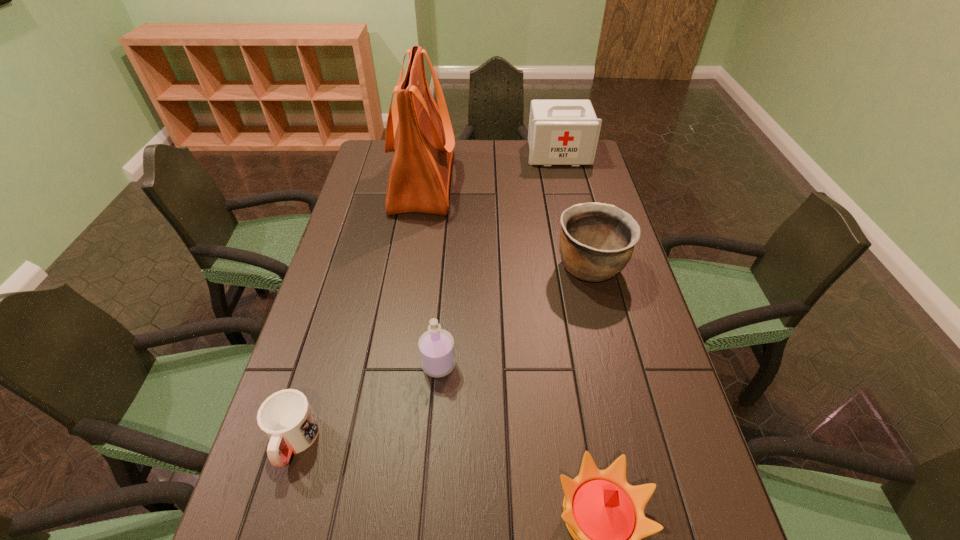
Image resolution: width=960 pixels, height=540 pixels. Identify the location of free point at the left edge. (276, 526).

You are a GUI agent. You are given a task and a screenshot of the screen. Output one action in this format:
    pyautogui.click(x=<x>, y=<y>)
    Task: Click on the vacant space at the right edge of the desktop
    The height and width of the screenshot is (540, 960).
    Given the screenshot: What is the action you would take?
    pyautogui.click(x=658, y=533)

I want to click on vacant space in between the perfume and the pottery, so click(515, 316).

The image size is (960, 540). What are the coordinates of `vacant point located between the third farthest object and the perfume` in the screenshot? It's located at 515,316.

This screenshot has height=540, width=960. I want to click on unoccupied position between the second tallest object and the shopping bag, so click(491, 168).

Identify the location of free space that is in between the first-aid kit and the tallest object. (491, 168).

The height and width of the screenshot is (540, 960). Identify the location of unoccupied position between the shortest object and the perfume. (366, 403).

Find the location of a particular element. This screenshot has width=960, height=540. vacant space in between the tallest object and the shortest object is located at coordinates (358, 312).

Locate an element on the screen. The width and height of the screenshot is (960, 540). free point between the first-aid kit and the shortest object is located at coordinates (426, 298).

Identify which object is the fifth closest to the shopping bag. Please provide its 2D coordinates. Your answer should be formatted as a tuple, i.e. [(x, y)], where the tuple contains the x and y coordinates of a point satisfying the conditions above.

[(604, 514)]